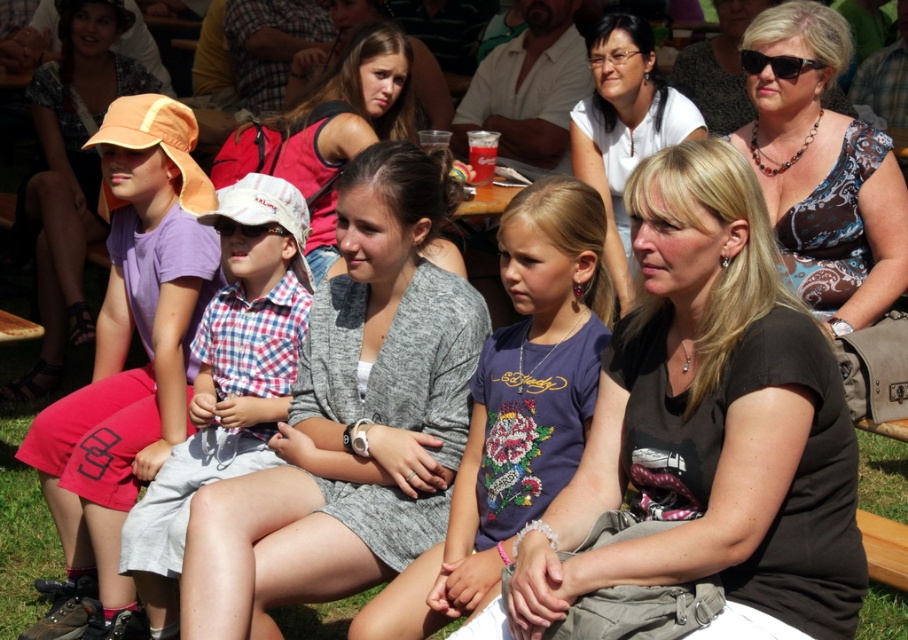
Question: Can you confirm if white matte shirt at center is positioned to the right of green grass at lower center?

Choices:
 (A) yes
 (B) no

Answer: (B)

Question: Which point is closer to the camera?

Choices:
 (A) purple cotton shirt at center
 (B) matte orange hat at left
 (C) checkered fabric shirt at left

Answer: (A)

Question: Which of the following is the farthest from the observer?

Choices:
 (A) gray cotton cardigan at center
 (B) white matte shirt at center
 (C) purple cotton shirt at center

Answer: (B)

Question: Can you confirm if purple cotton shirt at center is wider than brown patterned dress at center?

Choices:
 (A) yes
 (B) no

Answer: (A)

Question: Does checkered fabric shirt at left appear on the left side of white matte shirt at center?

Choices:
 (A) no
 (B) yes

Answer: (B)

Question: Which of these objects is positioned closest to the white matte shirt at center?

Choices:
 (A) black matte shirt at center
 (B) green grass at lower center

Answer: (A)